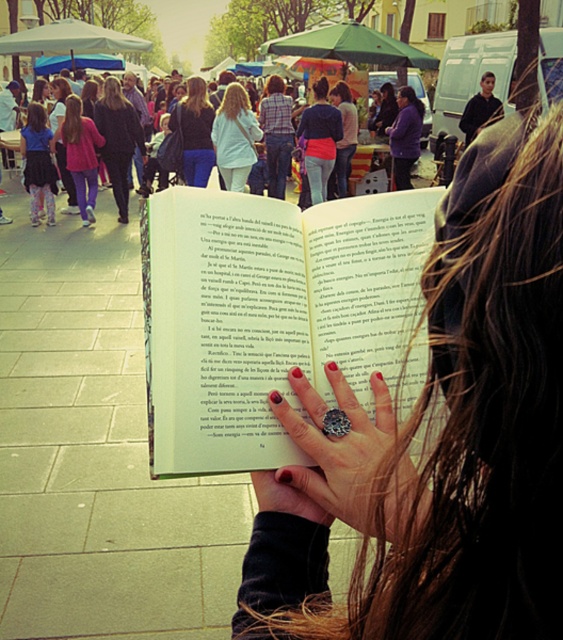
Who is more forward, [181,164] or [82,136]?

Point [82,136] is more forward.

Does matte black shirt at center have a larger size compared to matte pink pants at left?

Yes, matte black shirt at center is bigger than matte pink pants at left.

Does point (185, 145) lie in front of point (92, 160)?

Yes, point (185, 145) is closer to viewer.

The width and height of the screenshot is (563, 640). Find the location of `matte black shirt at center`. matte black shirt at center is located at coordinates (194, 132).

The width and height of the screenshot is (563, 640). What do you see at coordinates (118, 140) in the screenshot?
I see `dark blue jeans at center` at bounding box center [118, 140].

Is dark blue jeans at center thinner than matte black shirt at center?

Yes.

Which is behind, point (110, 96) or point (195, 148)?

Point (110, 96)

The height and width of the screenshot is (640, 563). What are the coordinates of `dark blue jeans at center` in the screenshot? It's located at (118, 140).

Who is higher up, matte black shirt at center or matte black jacket at center?

Positioned higher is matte black jacket at center.

Between matte black shirt at center and matte black jacket at center, which one appears on the left side from the viewer's perspective?

From the viewer's perspective, matte black shirt at center appears more on the left side.

Is point (196, 163) in front of point (342, 109)?

Yes, point (196, 163) is in front of point (342, 109).

In order to click on matte black shirt at center in this screenshot , I will do `click(194, 132)`.